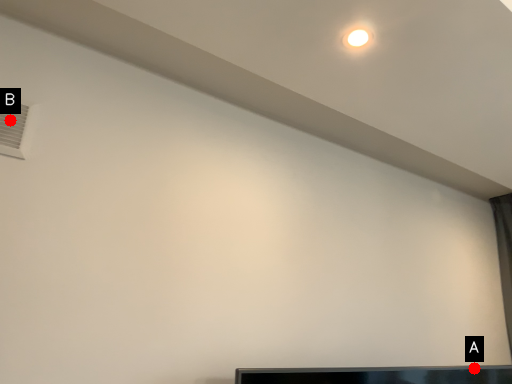
Question: Two points are circled on the image, labeled by A and B beside each circle. Which of the following is the closest to the observer?

Choices:
 (A) A is closer
 (B) B is closer

Answer: (B)